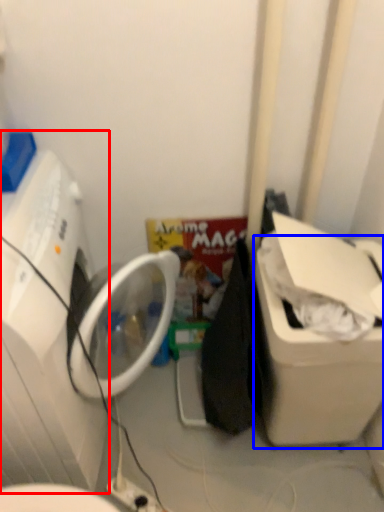
Question: Which of the following is the closest to the observer, washing machine (highlighted by a red box) or water cooler (highlighted by a blue box)?

Choices:
 (A) washing machine
 (B) water cooler

Answer: (A)